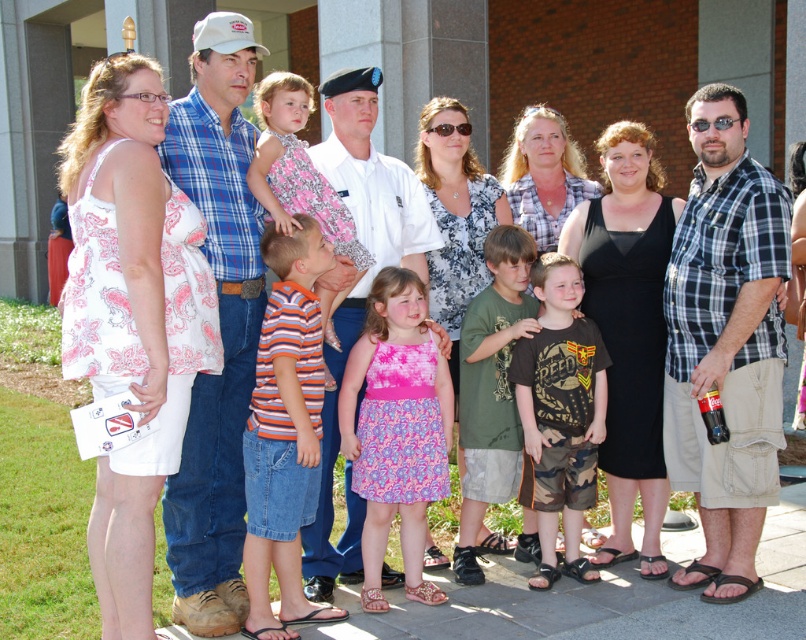
You are a photographer setting up for a group photo. You notice the white printed dress at left and the orange striped shirt at center. Considering their sizes, which clothing item might require more space to avoid being crowded in the photo?

The white printed dress at left requires more space because its width is larger than the orange striped shirt at center.

You are standing at the point marked as point (690, 426) and want to take a photo of the group of people in the scene. The camera you have can focus on subjects up to 5 meters away. Will the camera be able to focus on the group?

The distance between point (690, 426) and the camera is 4.76 meters, which is within the camera focus range of 5 meters. Therefore, the camera can focus on the group.

You are a photographer trying to adjust the camera focus. You notice two shirts in the image, the plaid shirt at right and the green cotton shirt at center. Which shirt should you focus on first if you want to ensure the taller one is in sharp focus?

The plaid shirt at right is taller than the green cotton shirt at center, so you should focus on the plaid shirt at right first to ensure it is in sharp focus.